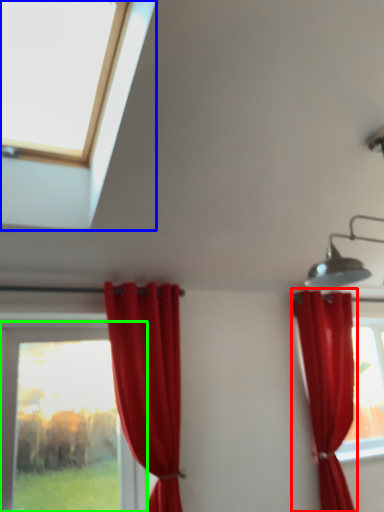
Question: Estimate the real-world distances between objects in this image. Which object is farther from curtain (highlighted by a red box), window (highlighted by a blue box) or window (highlighted by a green box)?

Choices:
 (A) window
 (B) window

Answer: (B)